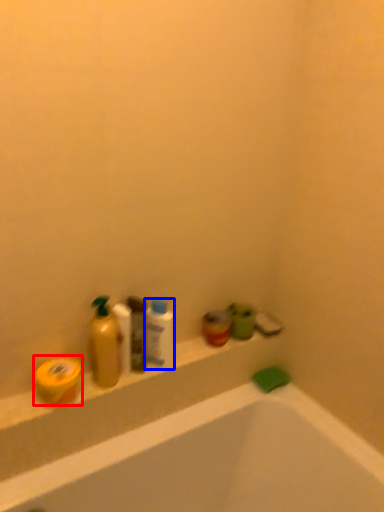
Question: Among these objects, which one is farthest to the camera, soap (highlighted by a red box) or mouthwash (highlighted by a blue box)?

Choices:
 (A) soap
 (B) mouthwash

Answer: (B)